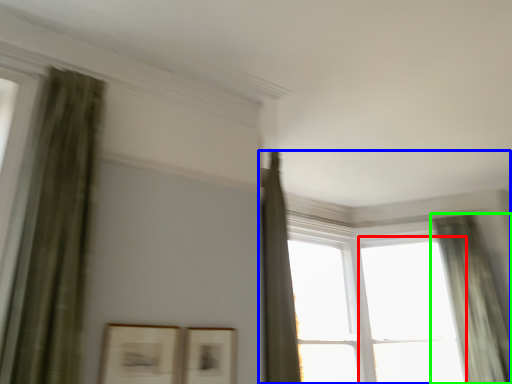
Question: Considering the real-world distances, which object is closest to window (highlighted by a red box)? window (highlighted by a blue box) or curtain (highlighted by a green box).

Choices:
 (A) window
 (B) curtain

Answer: (B)